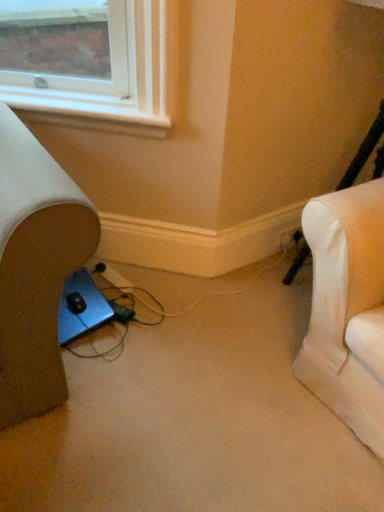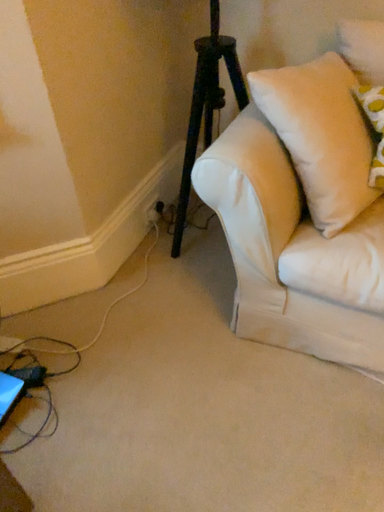
Question: How did the camera likely rotate when shooting the video?

Choices:
 (A) rotated right
 (B) rotated left

Answer: (A)